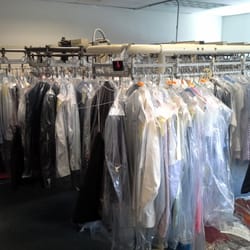
Find the location of `floor`. floor is located at coordinates (231, 237).